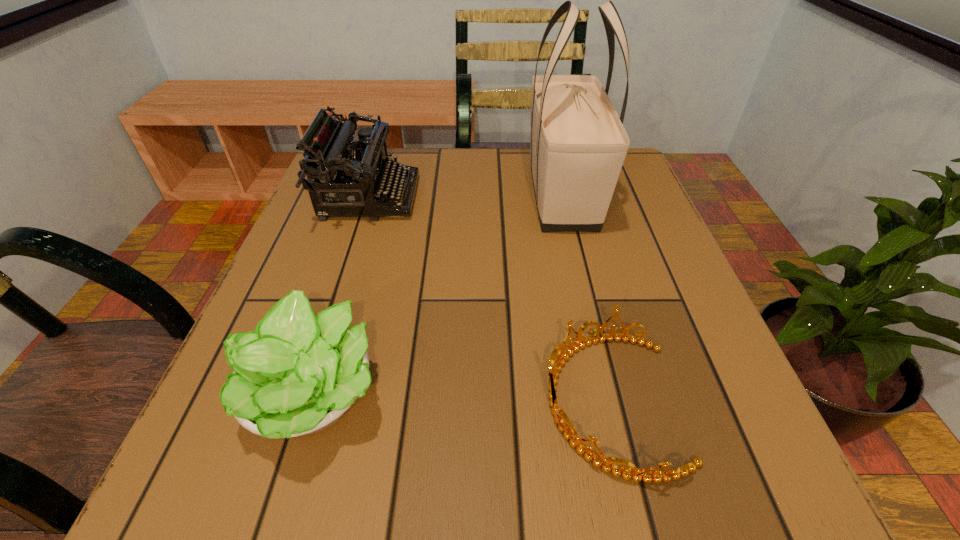
Find the location of `object at the far right corner`. object at the far right corner is located at coordinates (578, 146).

Locate an element on the screen. The height and width of the screenshot is (540, 960). object that is at the near right corner is located at coordinates point(646,475).

The width and height of the screenshot is (960, 540). What are the coordinates of `vacant space at the far edge` in the screenshot? It's located at (452, 160).

Image resolution: width=960 pixels, height=540 pixels. In the image, there is a desktop. Find the location of `vacant space at the near edge`. vacant space at the near edge is located at coordinates (350, 448).

In the image, there is a desktop. In order to click on vacant space at the left edge in this screenshot , I will do `click(370, 234)`.

This screenshot has width=960, height=540. I want to click on vacant space at the right edge, so click(x=608, y=251).

At what (x,y) coordinates should I click in order to perform the action: click on vacant area that lies between the lettuce and the tiara. Please return your answer as a coordinate pair (x, y). This screenshot has width=960, height=540. Looking at the image, I should click on (462, 398).

Where is `free point between the tiara and the lettuce`? The height and width of the screenshot is (540, 960). free point between the tiara and the lettuce is located at coordinates (462, 398).

This screenshot has width=960, height=540. Find the location of `unoccupied area between the lettuce and the third shortest object`. unoccupied area between the lettuce and the third shortest object is located at coordinates (341, 296).

This screenshot has height=540, width=960. Find the location of `free spot between the tiara and the typewriter`. free spot between the tiara and the typewriter is located at coordinates (490, 299).